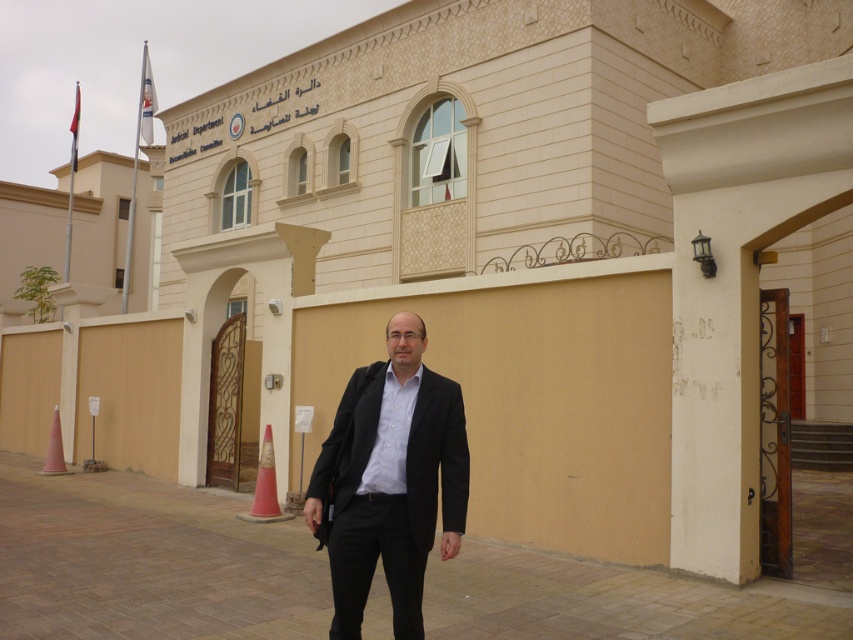
Question: Does black matte suit at center appear over orange plastic cone at lower center?

Choices:
 (A) no
 (B) yes

Answer: (B)

Question: Which is farther from the orange plastic cone at lower left?

Choices:
 (A) black matte suit at center
 (B) orange plastic cone at lower center

Answer: (A)

Question: Does black matte suit at center come behind orange plastic cone at lower left?

Choices:
 (A) no
 (B) yes

Answer: (A)

Question: Which of the following is the farthest from the observer?

Choices:
 (A) (265, 451)
 (B) (434, 408)

Answer: (A)

Question: Which object is closer to the camera taking this photo?

Choices:
 (A) orange plastic cone at lower left
 (B) black matte suit at center

Answer: (B)

Question: Can you confirm if orange plastic cone at lower center is positioned below orange plastic cone at lower left?

Choices:
 (A) no
 (B) yes

Answer: (A)